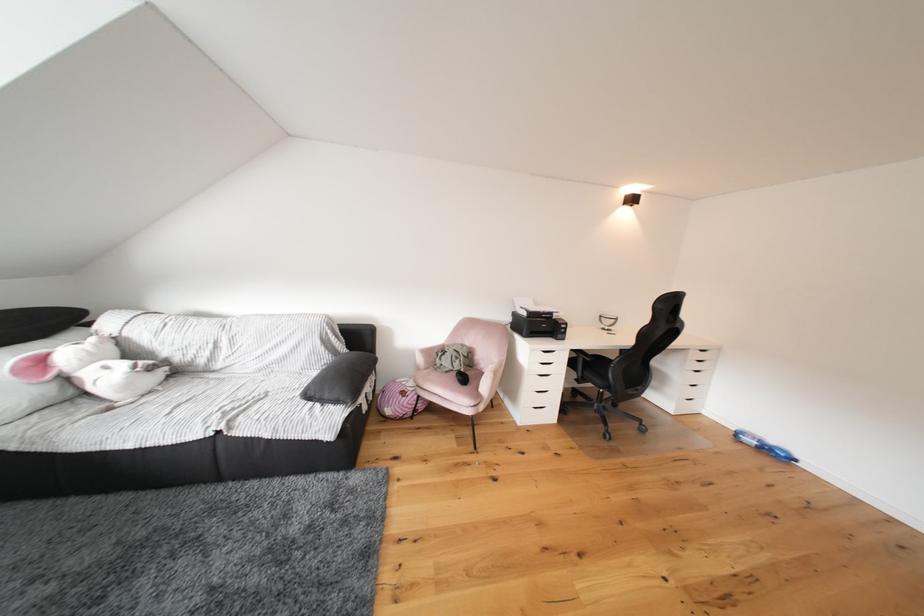
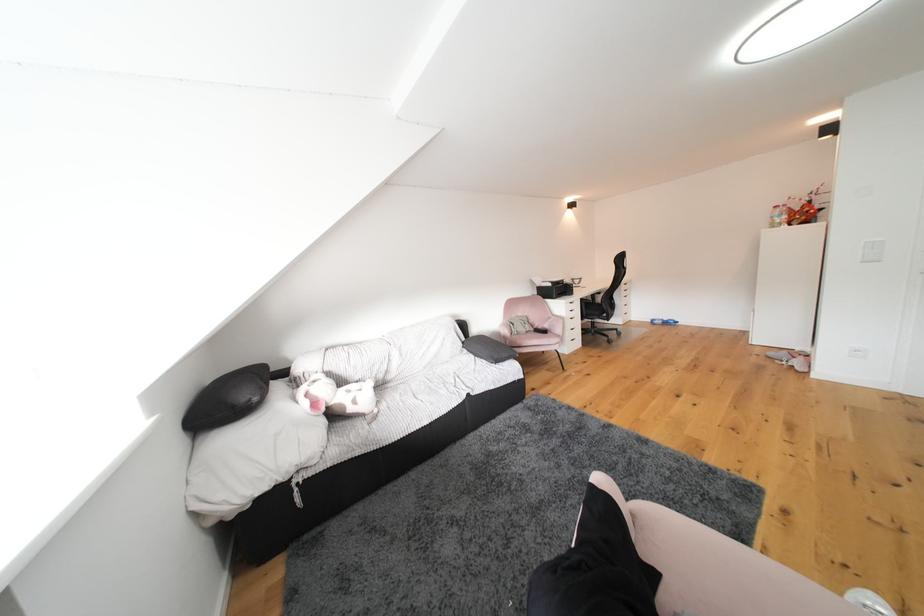
Question: In a continuous first-person perspective shot, in which direction is the camera moving?

Choices:
 (A) Left
 (B) Right
 (C) Forward
 (D) Backward

Answer: (A)